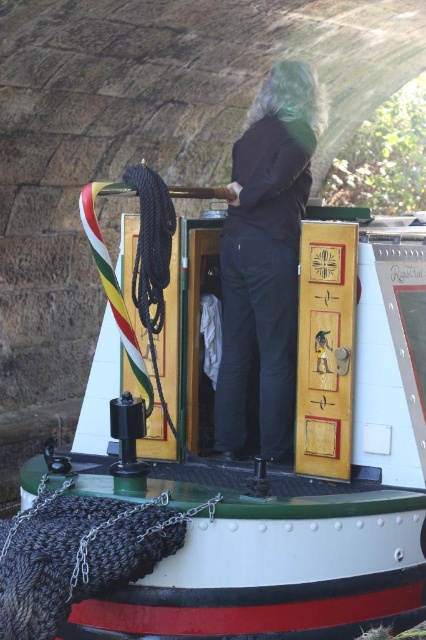
Consider the image. Is white glossy boat at center taller than dark blue jeans at center?

Correct, white glossy boat at center is much taller as dark blue jeans at center.

The image size is (426, 640). Describe the element at coordinates (233, 460) in the screenshot. I see `white glossy boat at center` at that location.

The image size is (426, 640). In order to click on white glossy boat at center in this screenshot , I will do `click(233, 460)`.